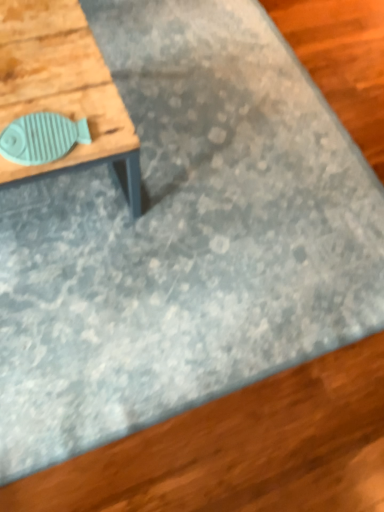
Measure the distance between point (x=51, y=165) and camera.

They are 37.80 inches apart.

Image resolution: width=384 pixels, height=512 pixels. I want to click on teal matte fish-shaped object at upper left, so click(x=59, y=97).

Describe the element at coordinates (59, 97) in the screenshot. This screenshot has width=384, height=512. I see `teal matte fish-shaped object at upper left` at that location.

At what (x,y) coordinates should I click in order to perform the action: click on teal matte fish-shaped object at upper left. Please return your answer as a coordinate pair (x, y). This screenshot has height=512, width=384. Looking at the image, I should click on (59, 97).